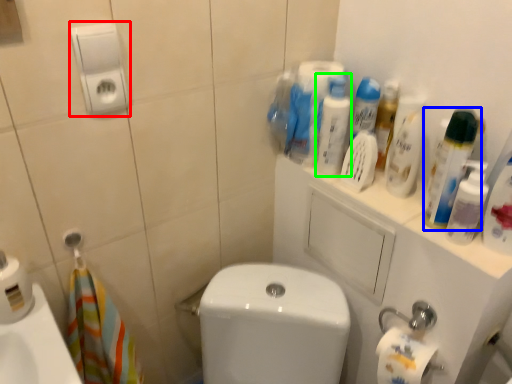
Question: Which is farther away from hand dryer (highlighted by a red box)? cleaning product (highlighted by a blue box) or cleaning product (highlighted by a green box)?

Choices:
 (A) cleaning product
 (B) cleaning product

Answer: (A)